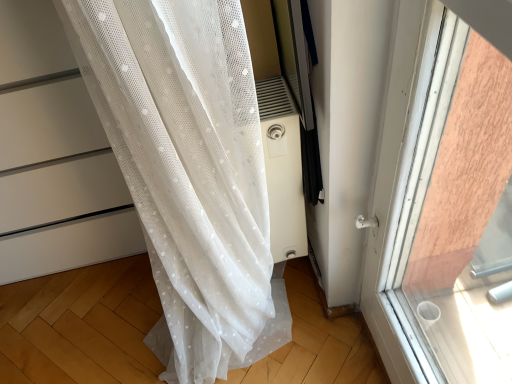
Question: Should I look upward or downward to see white sheer curtain at left?

Choices:
 (A) down
 (B) up

Answer: (B)